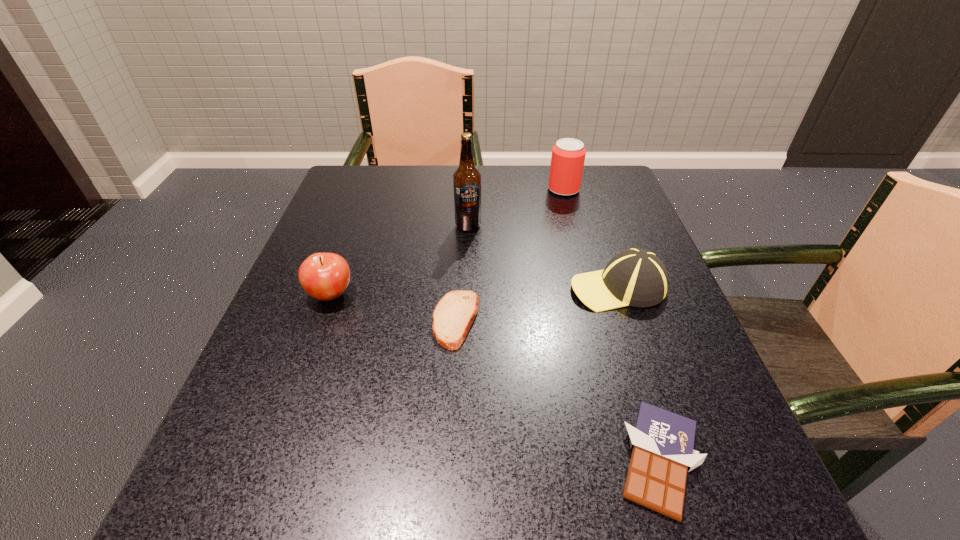
Locate an element on the screen. beer bottle is located at coordinates (467, 179).

Locate an element on the screen. The image size is (960, 540). the tallest object is located at coordinates point(467,179).

In order to click on beer can in this screenshot , I will do `click(568, 155)`.

Locate an element on the screen. the fifth shortest object is located at coordinates (568, 155).

Locate an element on the screen. The image size is (960, 540). the leftmost object is located at coordinates (324, 276).

Locate an element on the screen. The image size is (960, 540). baseball cap is located at coordinates (636, 277).

At what (x,y) coordinates should I click in order to perform the action: click on pita bread. Please return your answer as a coordinate pair (x, y). The image size is (960, 540). Looking at the image, I should click on [x=453, y=316].

Find the location of a particular element. This screenshot has height=540, width=960. chocolate bar is located at coordinates (662, 442).

Image resolution: width=960 pixels, height=540 pixels. What are the coordinates of `free space located 0.060m on the label of the fifth nearest object` in the screenshot? It's located at (468, 249).

Where is `vacant space located on the left of the fifth shortest object`? Image resolution: width=960 pixels, height=540 pixels. vacant space located on the left of the fifth shortest object is located at coordinates (396, 190).